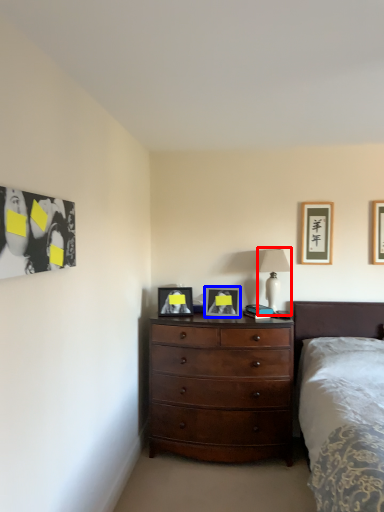
Question: Which object appears farthest to the camera in this image, lamp (highlighted by a red box) or picture frame (highlighted by a blue box)?

Choices:
 (A) lamp
 (B) picture frame

Answer: (A)